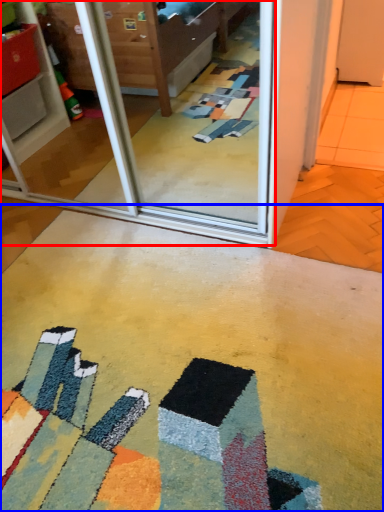
Question: Which object appears farthest to the camera in this image, screen door (highlighted by a red box) or concrete (highlighted by a blue box)?

Choices:
 (A) screen door
 (B) concrete

Answer: (A)